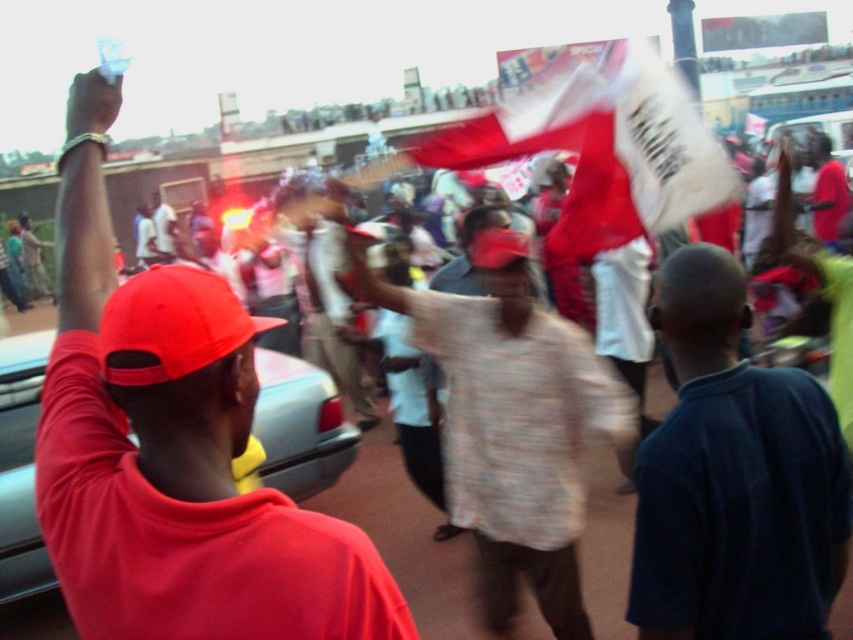
Question: Where is matte red cap at left located in relation to metallic gray car at left in the image?

Choices:
 (A) above
 (B) below

Answer: (A)

Question: Does white fabric flag at center appear over metallic gray car at left?

Choices:
 (A) yes
 (B) no

Answer: (A)

Question: Can you confirm if light brown textured shirt at center is positioned to the left of matte red baseball cap at left?

Choices:
 (A) no
 (B) yes

Answer: (A)

Question: Which is farther from the matte red cap at left?

Choices:
 (A) dark blue fabric shirt at center
 (B) matte red cap at upper left
 (C) light brown textured shirt at center

Answer: (B)

Question: Which is farther from the matte red cap at left?

Choices:
 (A) light brown textured shirt at center
 (B) dark blue fabric shirt at center
 (C) matte red cap at upper left

Answer: (C)

Question: Which is farther from the white fabric flag at center?

Choices:
 (A) matte red cap at left
 (B) matte red cap at upper left
 (C) light brown textured shirt at center
 (D) matte red baseball cap at left

Answer: (B)